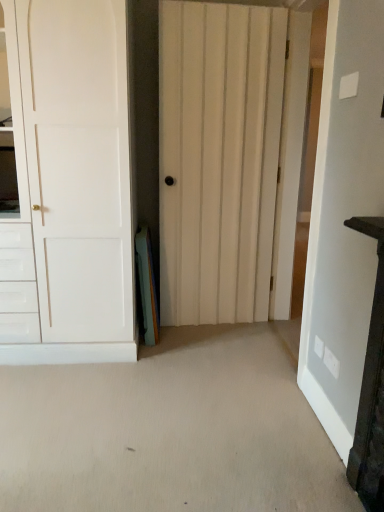
Where is `white wood door at center, which is the second door from right to left`? This screenshot has width=384, height=512. white wood door at center, which is the second door from right to left is located at coordinates (218, 158).

Locate an element on the screen. white wooden door at center, marked as the third door in a left-to-right arrangement is located at coordinates (343, 218).

Where is `white wood door at center, positioned as the second door in left-to-right order`? white wood door at center, positioned as the second door in left-to-right order is located at coordinates pyautogui.click(x=218, y=158).

Is white wooden door at center, the first door in the right-to-left sequence, not inside white matte door at left, the 1th door in the left-to-right sequence?

Absolutely, white wooden door at center, the first door in the right-to-left sequence, is external to white matte door at left, the 1th door in the left-to-right sequence.

From a real-world perspective, who is located lower, white wooden door at center, marked as the third door in a left-to-right arrangement, or white matte door at left, the 1th door in the left-to-right sequence?

From a 3D spatial view, white matte door at left, the 1th door in the left-to-right sequence, is below.

From the image's perspective, is white wooden door at center, the first door in the right-to-left sequence, on white matte door at left, the 3th door viewed from the right?

Incorrect, from the image's perspective, white wooden door at center, the first door in the right-to-left sequence, is lower than white matte door at left, the 3th door viewed from the right.

Considering the relative sizes of dark wood vanity at right and white matte door at left, the 1th door in the left-to-right sequence, in the image provided, is dark wood vanity at right wider than white matte door at left, the 1th door in the left-to-right sequence,?

Incorrect, the width of dark wood vanity at right does not surpass that of white matte door at left, the 1th door in the left-to-right sequence.

Is dark wood vanity at right placed right next to white matte door at left, the 1th door in the left-to-right sequence?

dark wood vanity at right and white matte door at left, the 1th door in the left-to-right sequence, are clearly separated.

Considering the sizes of objects dark wood vanity at right and white matte door at left, the 1th door in the left-to-right sequence, in the image provided, who is smaller, dark wood vanity at right or white matte door at left, the 1th door in the left-to-right sequence,?

dark wood vanity at right is smaller.

The height and width of the screenshot is (512, 384). Identify the location of vanity located in front of the white wood door at center, positioned as the second door in left-to-right order. (371, 389).

In terms of height, does dark wood vanity at right look taller or shorter compared to white wood door at center, which is the second door from right to left?

dark wood vanity at right is shorter than white wood door at center, which is the second door from right to left.

Which object is further away from the camera, dark wood vanity at right or white wood door at center, positioned as the second door in left-to-right order?

white wood door at center, positioned as the second door in left-to-right order, is behind.

Considering the sizes of dark wood vanity at right and white wood door at center, which is the second door from right to left, in the image, is dark wood vanity at right bigger or smaller than white wood door at center, which is the second door from right to left,?

Clearly, dark wood vanity at right is smaller in size than white wood door at center, which is the second door from right to left.

Identify the location of vanity that appears below the white wood door at center, which is the second door from right to left (from the image's perspective). (371, 389).

Is white wood door at center, positioned as the second door in left-to-right order, in front of or behind dark wood vanity at right in the image?

In the image, white wood door at center, positioned as the second door in left-to-right order, appears behind dark wood vanity at right.

Which object is positioned more to the left, white wood door at center, positioned as the second door in left-to-right order, or dark wood vanity at right?

white wood door at center, positioned as the second door in left-to-right order.

Is white wood door at center, positioned as the second door in left-to-right order, inside or outside of dark wood vanity at right?

white wood door at center, positioned as the second door in left-to-right order, is outside dark wood vanity at right.

Which object is closer to the camera taking this photo, white matte door at left, the 3th door viewed from the right, or white wooden door at center, marked as the third door in a left-to-right arrangement?

white wooden door at center, marked as the third door in a left-to-right arrangement, is in front.

From the white wooden door at center, marked as the third door in a left-to-right arrangement, count the 2nd door to the left and point to it. Please provide its 2D coordinates.

[(69, 186)]

Is point (92, 155) positioned behind point (345, 428)?

Yes, it is.

From a real-world perspective, is white matte door at left, the 3th door viewed from the right, over white wooden door at center, marked as the third door in a left-to-right arrangement?

Incorrect, from a real-world perspective, white matte door at left, the 3th door viewed from the right, is lower than white wooden door at center, marked as the third door in a left-to-right arrangement.

From a real-world perspective, is white wooden door at center, the first door in the right-to-left sequence, over dark wood vanity at right?

Correct, in the physical world, white wooden door at center, the first door in the right-to-left sequence, is higher than dark wood vanity at right.

Would you consider white wooden door at center, the first door in the right-to-left sequence, to be distant from dark wood vanity at right?

Actually, white wooden door at center, the first door in the right-to-left sequence, and dark wood vanity at right are a little close together.

Which is less distant, (x=343, y=128) or (x=353, y=486)?

The point (x=353, y=486) is closer to the camera.

Can you tell me how much white wooden door at center, the first door in the right-to-left sequence, and dark wood vanity at right differ in facing direction?

The angle between the facing direction of white wooden door at center, the first door in the right-to-left sequence, and the facing direction of dark wood vanity at right is 0.000481 degrees.

Find the location of a particular element. This screenshot has width=384, height=512. the 2nd door positioned above the white wooden door at center, the first door in the right-to-left sequence (from the image's perspective) is located at coordinates (218, 158).

Is point (361, 362) positioned in front of point (193, 320)?

Yes, point (361, 362) is closer to viewer.

Consider the image. Is white wood door at center, which is the second door from right to left, located within white wooden door at center, marked as the third door in a left-to-right arrangement?

Actually, white wood door at center, which is the second door from right to left, is outside white wooden door at center, marked as the third door in a left-to-right arrangement.

Does white wooden door at center, the first door in the right-to-left sequence, lie in front of white wood door at center, which is the second door from right to left?

Yes, it is.

Locate an element on the screen. the 2nd door counting from the left of the white wooden door at center, the first door in the right-to-left sequence is located at coordinates [x=69, y=186].

Identify the location of vanity that appears below the white matte door at left, the 1th door in the left-to-right sequence (from the image's perspective). This screenshot has height=512, width=384. (x=371, y=389).

From the image, which object appears to be nearer to white matte door at left, the 1th door in the left-to-right sequence, dark wood vanity at right or white wood door at center, which is the second door from right to left?

white wood door at center, which is the second door from right to left, is positioned closer to the anchor white matte door at left, the 1th door in the left-to-right sequence.

Looking at the image, which one is located closer to white wooden door at center, marked as the third door in a left-to-right arrangement, white matte door at left, the 1th door in the left-to-right sequence, or dark wood vanity at right?

The object closer to white wooden door at center, marked as the third door in a left-to-right arrangement, is dark wood vanity at right.

Which object lies nearer to the anchor point white wooden door at center, the first door in the right-to-left sequence, white wood door at center, positioned as the second door in left-to-right order, or white matte door at left, the 1th door in the left-to-right sequence?

Based on the image, white wood door at center, positioned as the second door in left-to-right order, appears to be nearer to white wooden door at center, the first door in the right-to-left sequence.

Estimate the real-world distances between objects in this image. Which object is closer to dark wood vanity at right, white matte door at left, the 3th door viewed from the right, or white wood door at center, which is the second door from right to left?

white wood door at center, which is the second door from right to left, lies closer to dark wood vanity at right than the other object.

When comparing their distances from white matte door at left, the 3th door viewed from the right, does dark wood vanity at right or white wooden door at center, the first door in the right-to-left sequence, seem further?

Among the two, dark wood vanity at right is located further to white matte door at left, the 3th door viewed from the right.

Looking at this image, looking at the image, which one is located further to white wood door at center, positioned as the second door in left-to-right order, white wooden door at center, marked as the third door in a left-to-right arrangement, or white matte door at left, the 3th door viewed from the right?

Among the two, white wooden door at center, marked as the third door in a left-to-right arrangement, is located further to white wood door at center, positioned as the second door in left-to-right order.

Looking at the image, which one is located closer to white matte door at left, the 3th door viewed from the right, white wooden door at center, marked as the third door in a left-to-right arrangement, or dark wood vanity at right?

white wooden door at center, marked as the third door in a left-to-right arrangement, is closer to white matte door at left, the 3th door viewed from the right.

Which object lies nearer to the anchor point white wood door at center, which is the second door from right to left, dark wood vanity at right or white wooden door at center, the first door in the right-to-left sequence?

white wooden door at center, the first door in the right-to-left sequence, lies closer to white wood door at center, which is the second door from right to left, than the other object.

At what (x,y) coordinates should I click in order to perform the action: click on door between white matte door at left, the 3th door viewed from the right, and white wooden door at center, the first door in the right-to-left sequence. Please return your answer as a coordinate pair (x, y). The height and width of the screenshot is (512, 384). Looking at the image, I should click on (218, 158).